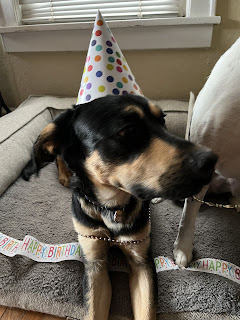
You are a GUI agent. You are given a task and a screenshot of the screen. Output one action in this format:
    pyautogui.click(x=<x>, y=<y>)
    Task: Click on the window blinds
    
    Given the screenshot: What is the action you would take?
    pyautogui.click(x=51, y=12)